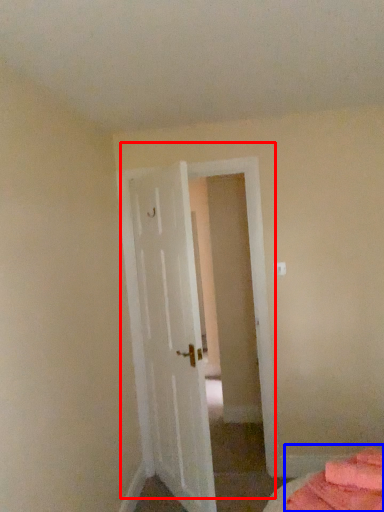
Question: Among these objects, which one is nearest to the camera, door (highlighted by a red box) or bed (highlighted by a blue box)?

Choices:
 (A) door
 (B) bed

Answer: (B)